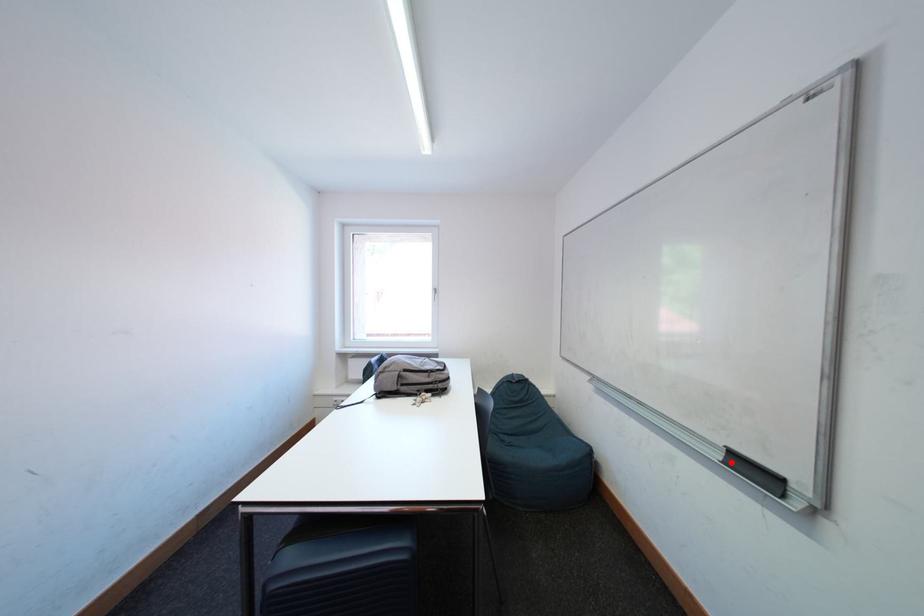
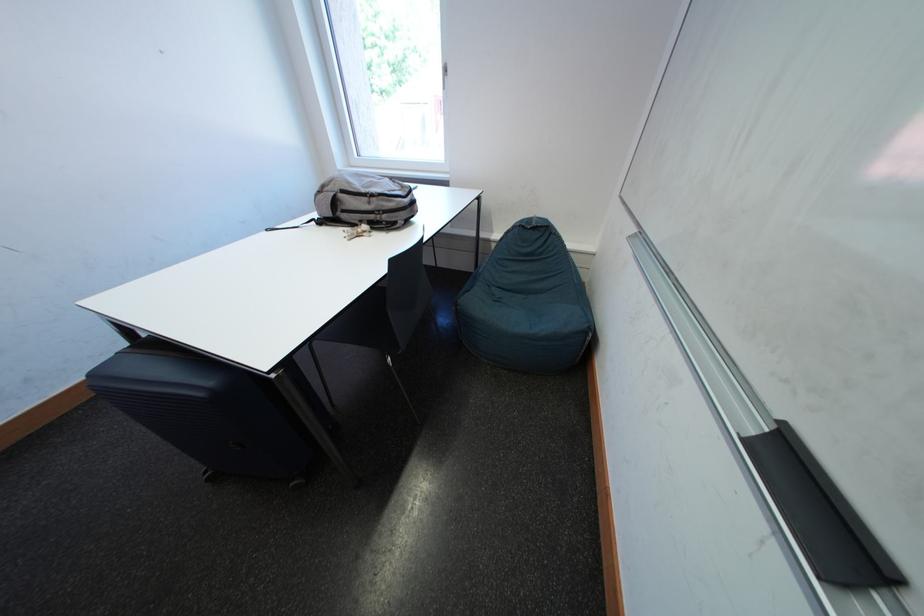
Where in the second image is the point corresponding to the highlighted location from the first image?

(762, 435)